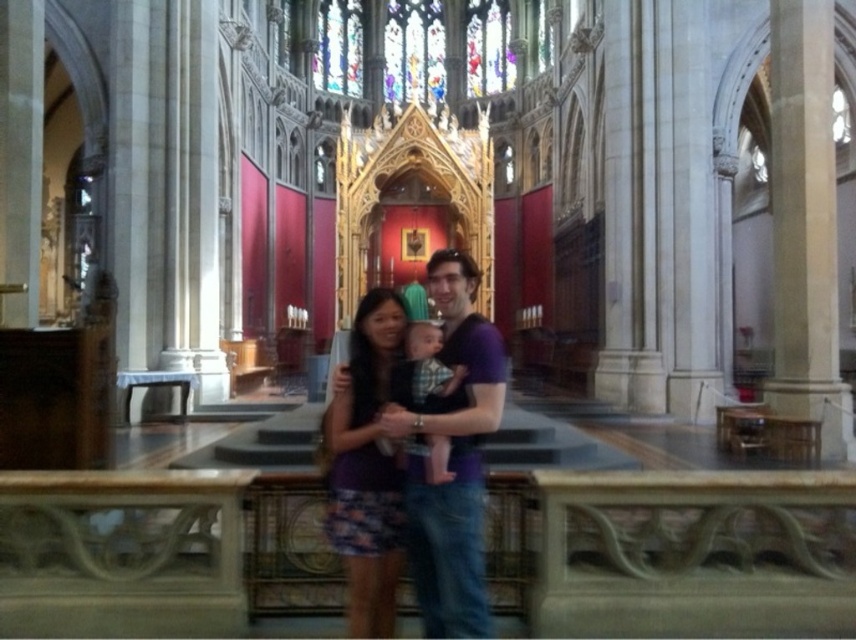
You are a photographer visiting the cathedral and want to capture both the purple cotton shirt at center and the purple fabric dress at center in a single shot. Since you want to ensure both are visible, which clothing item should you focus on to ensure the smaller one is in clear view?

The purple fabric dress at center is smaller than the purple cotton shirt at center. To ensure the smaller one is in clear view, focus on the purple fabric dress at center.

You are standing in the cathedral and want to take a photo of the two points. Which point, point (x=480, y=380) or point (x=366, y=364), is closer to you?

Point (x=480, y=380) is closer to you than point (x=366, y=364).

You are a visitor in the cathedral and see two people wearing purple clothing. The first person is wearing a purple cotton shirt at center, and the second is wearing a purple fabric dress at center. Which one is positioned to the right?

The purple cotton shirt at center is to the right of the purple fabric dress at center.